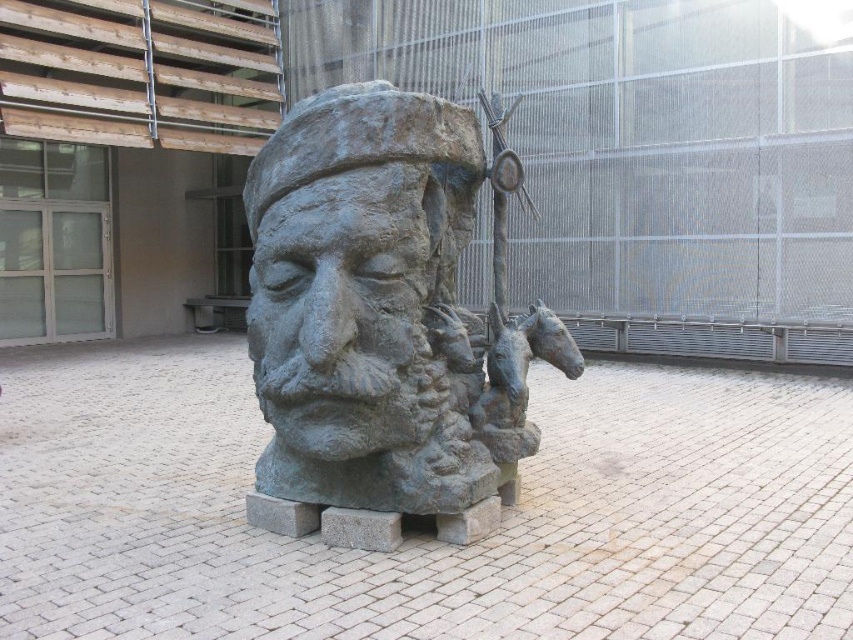
Question: Which of the following is the closest to the observer?

Choices:
 (A) (422, 433)
 (B) (480, 362)

Answer: (A)

Question: Which of the following is the farthest from the observer?

Choices:
 (A) (395, 241)
 (B) (434, 477)

Answer: (B)

Question: Where is bronze statue at center located in relation to bronze sculpture at center in the image?

Choices:
 (A) above
 (B) below

Answer: (B)

Question: Can you confirm if bronze statue at center is positioned to the left of bronze sculpture at center?

Choices:
 (A) no
 (B) yes

Answer: (A)

Question: Can you confirm if bronze statue at center is positioned to the left of bronze sculpture at center?

Choices:
 (A) yes
 (B) no

Answer: (B)